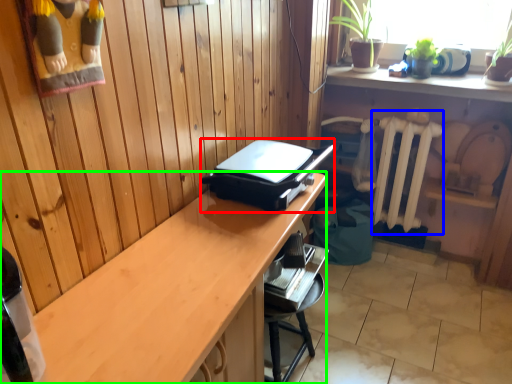
Question: Which object is the closest to the appliance (highlighted by a red box)? Choose among these: radiator (highlighted by a blue box) or desk (highlighted by a green box).

Choices:
 (A) radiator
 (B) desk

Answer: (B)